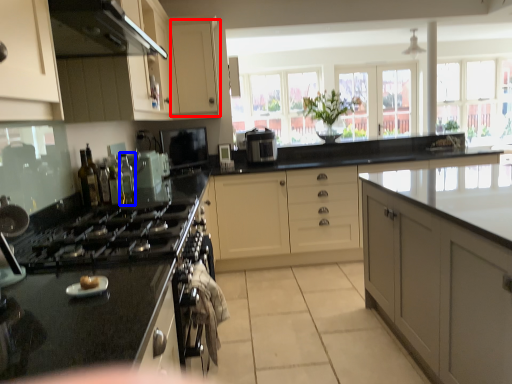
Question: Which point is further to the camera, cabinetry (highlighted by a red box) or bottle (highlighted by a blue box)?

Choices:
 (A) cabinetry
 (B) bottle

Answer: (A)